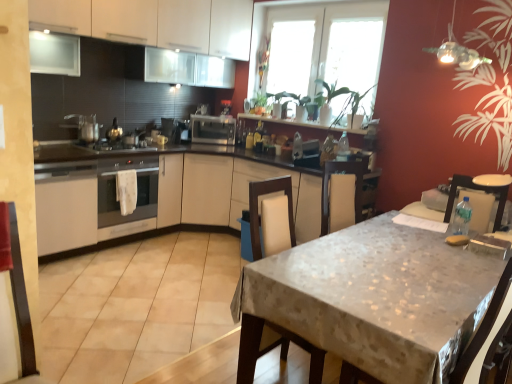
You are a GUI agent. You are given a task and a screenshot of the screen. Output one action in this format:
    pyautogui.click(x=<x>, y=<y>)
    Task: Click on the blank space situated above transparent glass window at upper center, which is counted as the second window, starting from the left (from a real-world perspective)
    
    Given the screenshot: What is the action you would take?
    pyautogui.click(x=332, y=3)